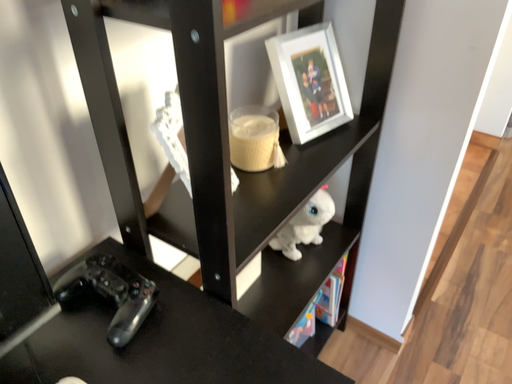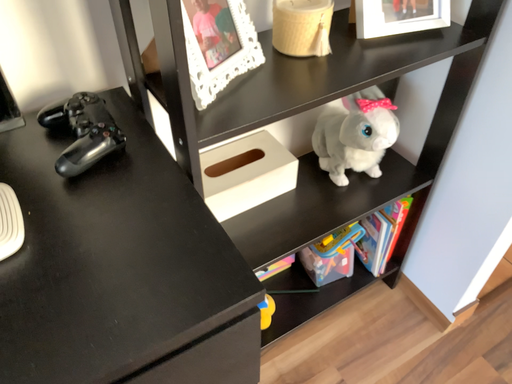
Question: Which way did the camera rotate in the video?

Choices:
 (A) rotated right
 (B) rotated left

Answer: (B)